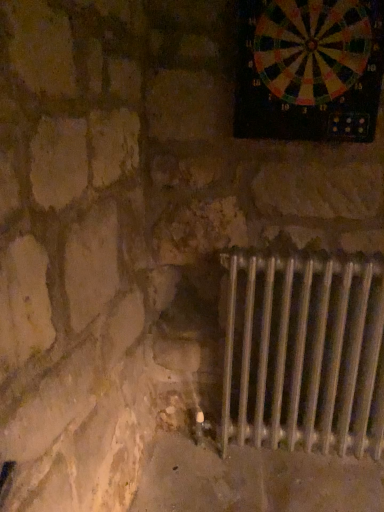
Question: Does point (329, 40) appear closer or farther from the camera than point (307, 433)?

Choices:
 (A) closer
 (B) farther

Answer: (A)

Question: Visually, is multicolored plastic dartboard at upper right positioned to the left or to the right of silver metallic radiator at lower right?

Choices:
 (A) left
 (B) right

Answer: (A)

Question: Is multicolored plastic dartboard at upper right bigger or smaller than silver metallic radiator at lower right?

Choices:
 (A) big
 (B) small

Answer: (B)

Question: Choose the correct answer: Is silver metallic radiator at lower right inside multicolored plastic dartboard at upper right or outside it?

Choices:
 (A) inside
 (B) outside

Answer: (B)

Question: Is silver metallic radiator at lower right to the left or to the right of multicolored plastic dartboard at upper right in the image?

Choices:
 (A) right
 (B) left

Answer: (A)

Question: Relative to multicolored plastic dartboard at upper right, is silver metallic radiator at lower right in front or behind?

Choices:
 (A) behind
 (B) front

Answer: (A)

Question: Based on their sizes in the image, would you say silver metallic radiator at lower right is bigger or smaller than multicolored plastic dartboard at upper right?

Choices:
 (A) small
 (B) big

Answer: (B)